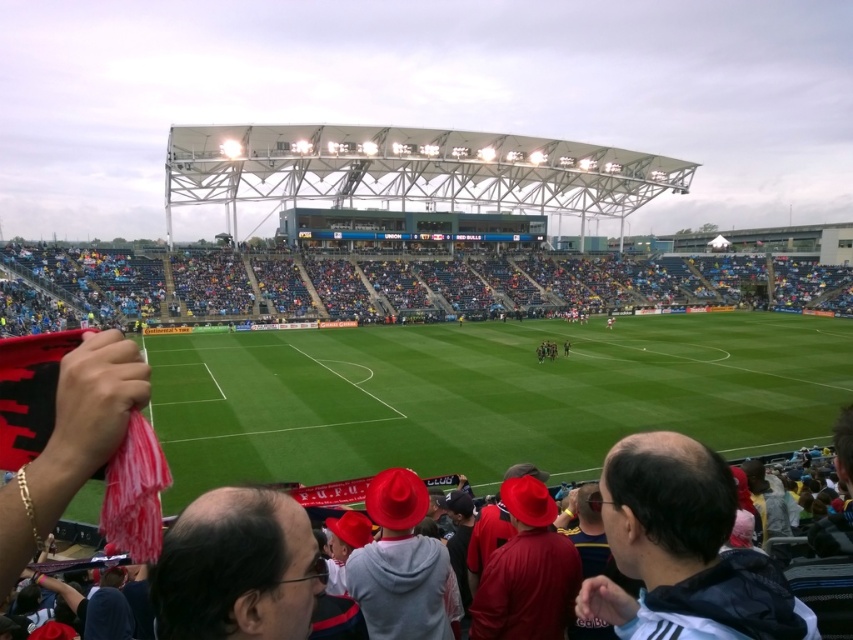
You are a photographer standing at the center of the soccer field. You want to take a photo of the red fabric at lower left. Which direction should you move to get the best shot?

The red fabric at lower left is located at point 0.447 on the x and 0.472 on the y coordinates. To get the best shot, you should move towards the lower left direction to align with the red fabric at lower left.

You are a drone operator tasked with capturing aerial footage of the soccer match. Your drone is currently positioned above the red fabric at lower left and needs to fly to the dark gray jacket at lower right. Given that the drone can travel at a maximum speed of 10 meters per second, how long will it take for the drone to reach its destination?

The distance between the red fabric at lower left and the dark gray jacket at lower right is 71.50 meters. At a speed of 10 meters per second, the drone will take approximately 7.15 seconds to reach its destination.

You are a photographer at the soccer match and want to capture a photo of both the red fabric at lower left and the dark gray jacket at lower right. Which object should you adjust your camera to focus on first if you want to include both in your frame?

The red fabric at lower left is to the right of the dark gray jacket at lower right, so you should focus on the dark gray jacket at lower right first to ensure both are in the frame.